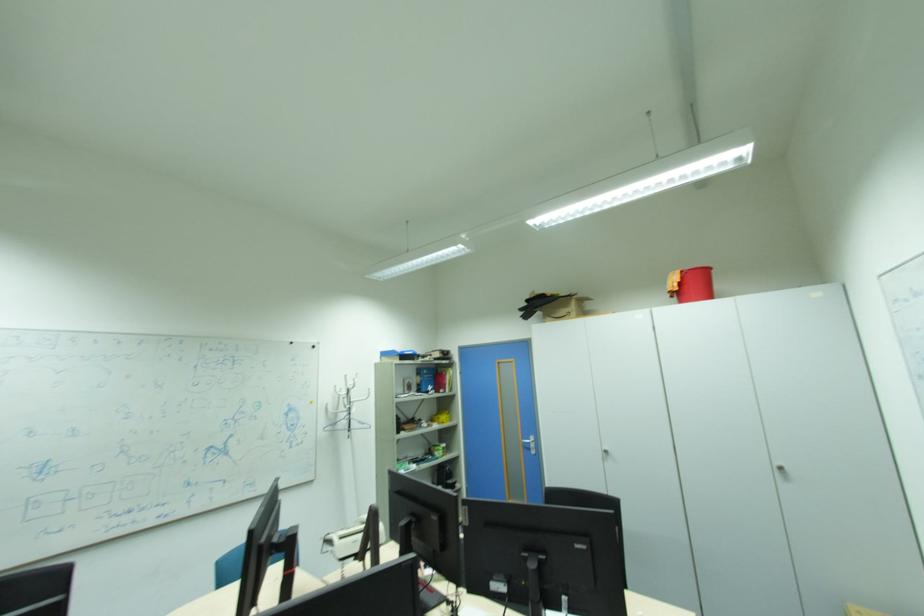
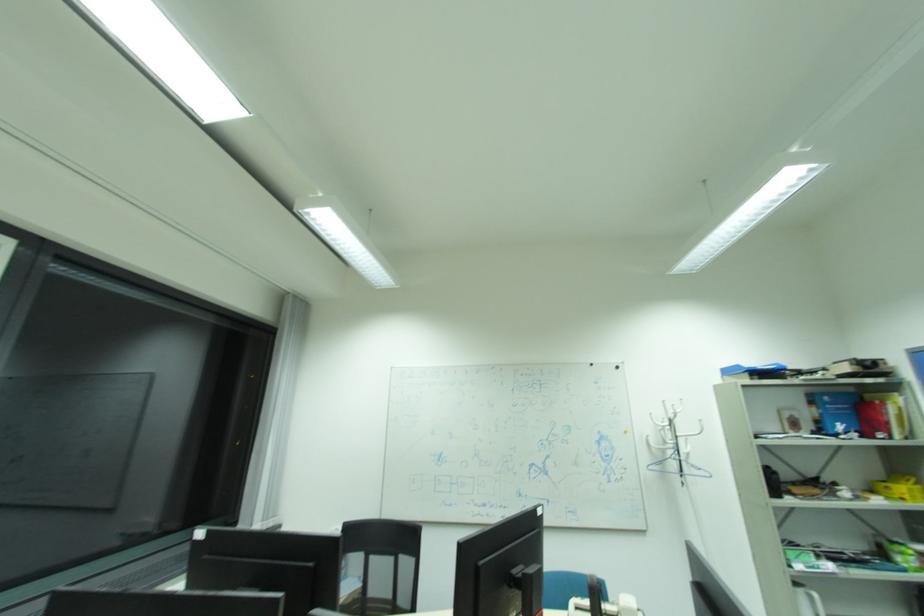
Question: The first image is from the beginning of the video and the second image is from the end. How did the camera likely rotate when shooting the video?

Choices:
 (A) Left
 (B) Right
 (C) Up
 (D) Down

Answer: (A)